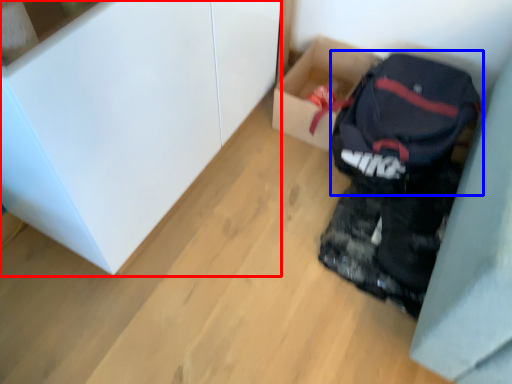
Question: Among these objects, which one is farthest to the camera, cabinetry (highlighted by a red box) or backpack (highlighted by a blue box)?

Choices:
 (A) cabinetry
 (B) backpack

Answer: (B)